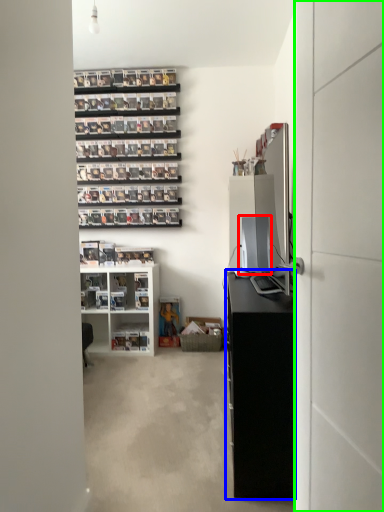
Question: Which object is positioned farthest from desktop computer (highlighted by a red box)? Select from cabinetry (highlighted by a blue box) and glass door (highlighted by a green box).

Choices:
 (A) cabinetry
 (B) glass door

Answer: (B)